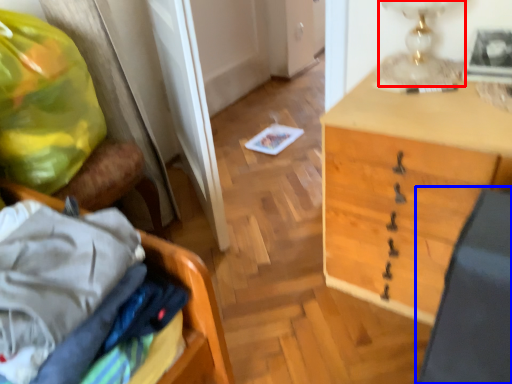
Question: Which object is further to the camera taking this photo, table lamp (highlighted by a red box) or swivel chair (highlighted by a blue box)?

Choices:
 (A) table lamp
 (B) swivel chair

Answer: (A)